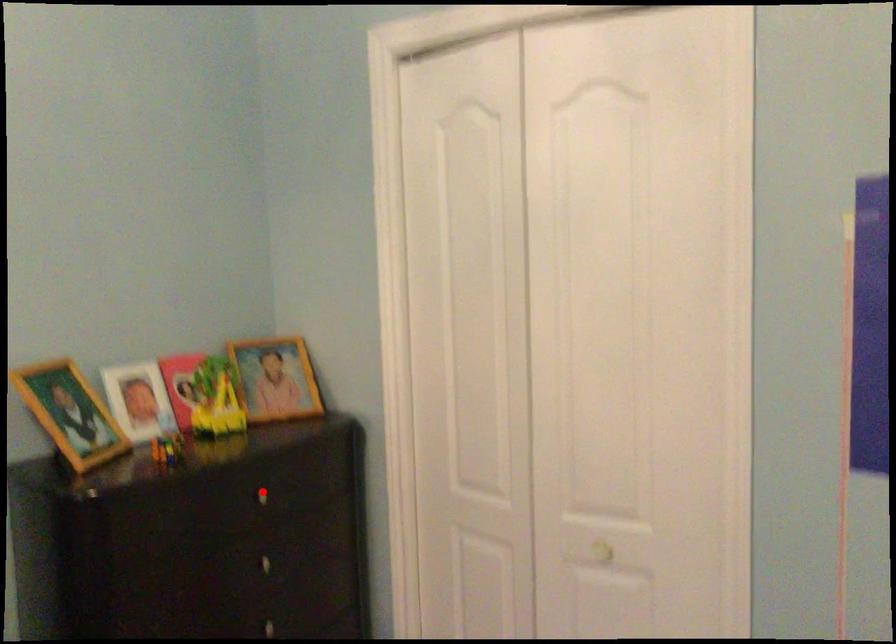
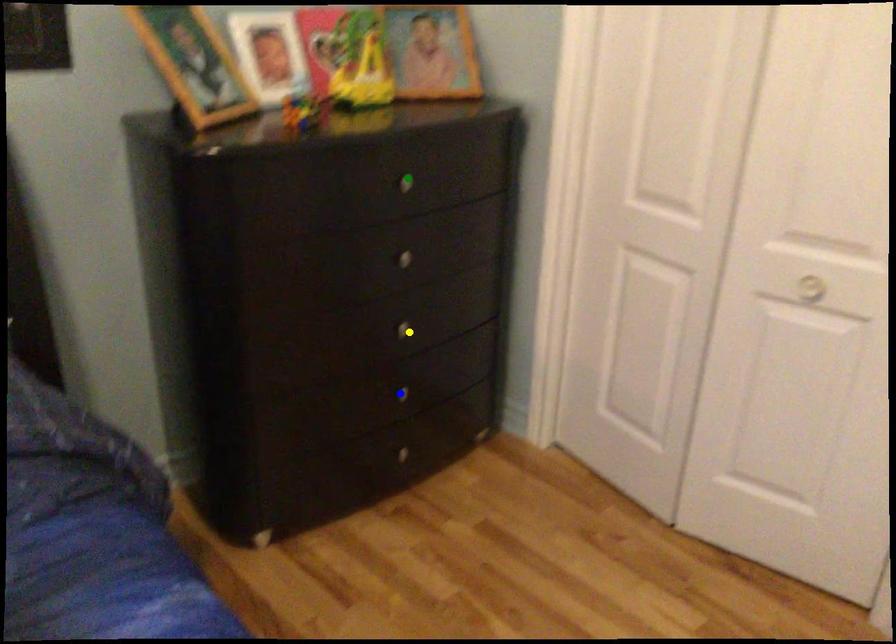
Question: I am providing you with two images of the same scene from different viewpoints. A red point is marked on the first image. You are given multiple points on the second image. In image 2, which mark is for the same physical point as the one in image 1?

Choices:
 (A) green point
 (B) yellow point
 (C) blue point

Answer: (A)